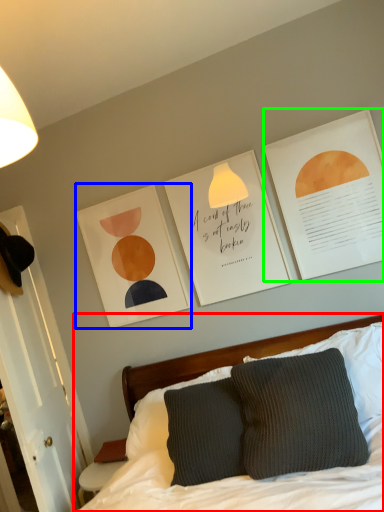
Question: Based on their relative distances, which object is farther from bed (highlighted by a red box)? Choose from picture frame (highlighted by a blue box) and postcard (highlighted by a green box).

Choices:
 (A) picture frame
 (B) postcard

Answer: (B)